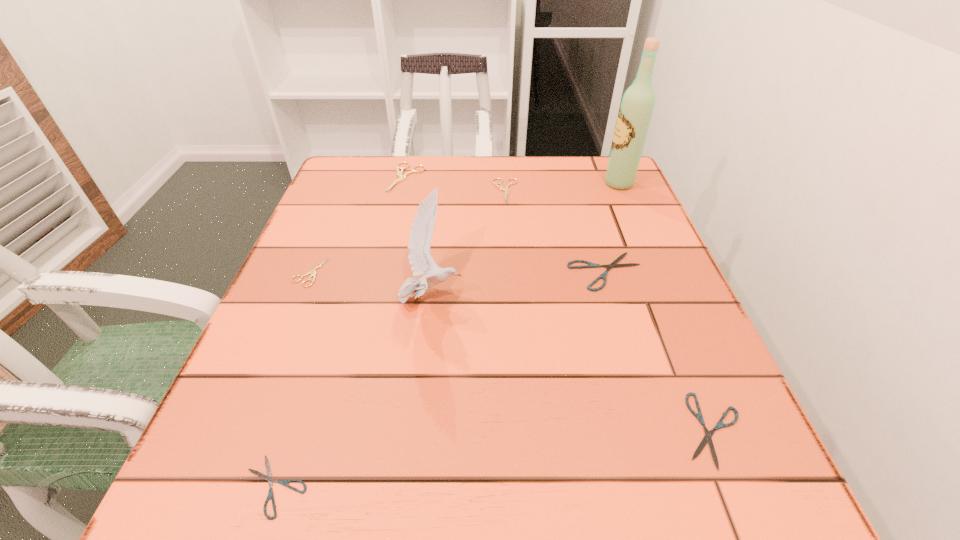
Where is `the nearest beige shears`? the nearest beige shears is located at coordinates (313, 272).

Locate an element on the screen. the second smallest black shears is located at coordinates (707, 438).

Locate an element on the screen. This screenshot has width=960, height=540. the smallest black shears is located at coordinates (268, 477).

You are a GUI agent. You are given a task and a screenshot of the screen. Output one action in this format:
    pyautogui.click(x=<x>, y=<y>)
    Task: Click on the shortest shears
    The width and height of the screenshot is (960, 540).
    Given the screenshot: What is the action you would take?
    pyautogui.click(x=268, y=477)

The width and height of the screenshot is (960, 540). What are the coordinates of `free space located 0.230m on the front-facing side of the white wine bottle` in the screenshot? It's located at (515, 184).

Image resolution: width=960 pixels, height=540 pixels. I want to click on vacant space located on the front-facing side of the white wine bottle, so click(573, 184).

In order to click on vacant space located 0.340m on the front-facing side of the white wine bottle in this screenshot , I will do `click(471, 184)`.

Find the location of a particular element. The width and height of the screenshot is (960, 540). free space located at the tip of the beak of the white gull is located at coordinates (575, 299).

Find the location of `blank space located 0.210m on the front of the sixth shortest object`. blank space located 0.210m on the front of the sixth shortest object is located at coordinates (390, 247).

This screenshot has width=960, height=540. Identify the location of vacant space positioned 0.160m on the front of the second smallest beige shears. (510, 247).